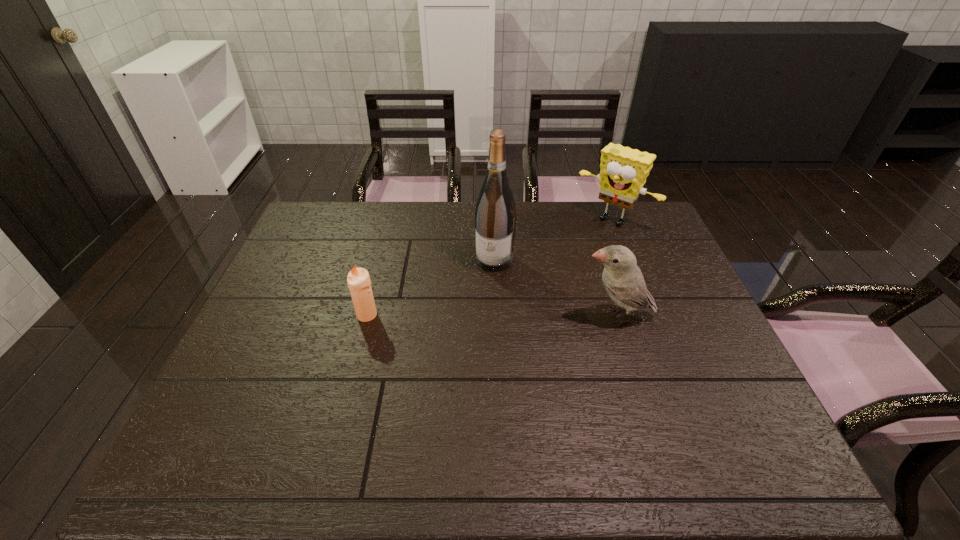
This screenshot has height=540, width=960. Identify the location of vacant space located on the front-facing side of the sponge. (560, 273).

In order to click on vacant point located 0.240m on the front-facing side of the sponge in this screenshot , I will do `click(562, 271)`.

Locate an element on the screen. vacant space located 0.170m on the front-facing side of the sponge is located at coordinates (572, 259).

I want to click on vacant space located on the label of the wine bottle, so click(468, 341).

Image resolution: width=960 pixels, height=540 pixels. In order to click on vacant position located 0.300m on the label of the wine bottle in this screenshot , I will do `click(466, 349)`.

The height and width of the screenshot is (540, 960). What are the coordinates of `vacant region located 0.170m on the label of the wine bottle` in the screenshot? It's located at (477, 313).

At what (x,y) coordinates should I click in order to perform the action: click on object situated at the far edge. Please return your answer as a coordinate pair (x, y). The image size is (960, 540). Looking at the image, I should click on (623, 171).

This screenshot has width=960, height=540. What are the coordinates of `bird present at the right edge` in the screenshot? It's located at (622, 278).

Find the location of a particular element. This screenshot has width=960, height=540. sponge present at the right edge is located at coordinates (623, 171).

Locate an element on the screen. The height and width of the screenshot is (540, 960). object that is at the far right corner is located at coordinates (623, 171).